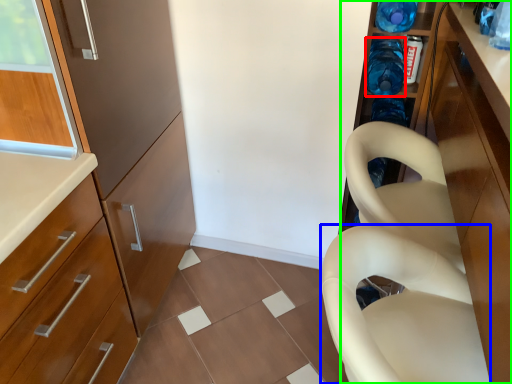
Question: Estimate the real-world distances between objects in this image. Which object is farther from bottle (highlighted by a red box), feeding chair (highlighted by a blue box) or cabinetry (highlighted by a green box)?

Choices:
 (A) feeding chair
 (B) cabinetry

Answer: (A)